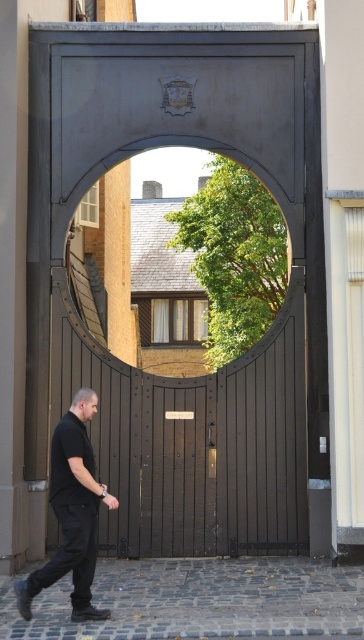
You are standing in front of the ornate metal gate and want to walk through the circular opening to reach the residential area. Which object, the brown cobblestone alley at lower center or the black matte pants at lower left, will you encounter first as you pass through the gate?

The brown cobblestone alley at lower center is closer to the viewer than the black matte pants at lower left, so you will encounter the brown cobblestone alley at lower center first as you pass through the gate.

You are standing in front of the dark brown wooden gate at center and want to walk through the brown cobblestone alley at lower center. Can you pass through the alley without touching the gate?

The dark brown wooden gate at center has a lesser width compared to the brown cobblestone alley at lower center, so yes, you can pass through the alley without touching the gate since the alley is wider than the gate.